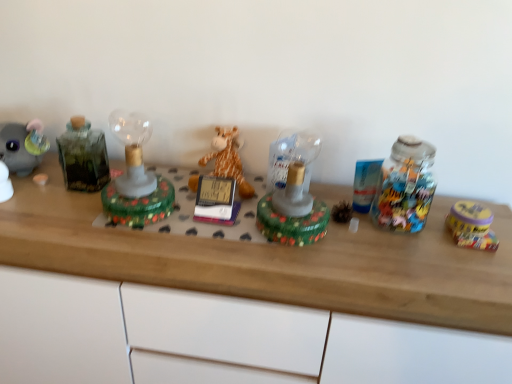
What do you see at coordinates (228, 159) in the screenshot? This screenshot has width=512, height=384. I see `soft plush giraffe at center, arranged as the third toy when viewed from the right` at bounding box center [228, 159].

What do you see at coordinates (272, 261) in the screenshot?
I see `wooden desk at center` at bounding box center [272, 261].

What do you see at coordinates (472, 226) in the screenshot? This screenshot has height=384, width=512. I see `yellow matte tin at right, acting as the 4th toy starting from the left` at bounding box center [472, 226].

What are the coordinates of `translucent glass lamp at center, the 2th toy positioned from the right` in the screenshot? It's located at (293, 195).

Is green glass bottle at left located within green glass lamp at center, the 1th toy in the left-to-right sequence?

No, green glass lamp at center, the 1th toy in the left-to-right sequence, does not contain green glass bottle at left.

From the picture: Is green glass lamp at center, which appears as the fourth toy when viewed from the right, bigger or smaller than green glass bottle at left?

green glass lamp at center, which appears as the fourth toy when viewed from the right, is bigger than green glass bottle at left.

From a real-world perspective, relative to green glass bottle at left, is green glass lamp at center, the 1th toy in the left-to-right sequence, vertically above or below?

green glass lamp at center, the 1th toy in the left-to-right sequence, is situated lower than green glass bottle at left in the real world.

Which of these two, yellow matte tin at right, the first toy when ordered from right to left, or green glass bottle at left, stands shorter?

yellow matte tin at right, the first toy when ordered from right to left.

Which of these two, yellow matte tin at right, acting as the 4th toy starting from the left, or green glass bottle at left, is bigger?

With larger size is green glass bottle at left.

Is yellow matte tin at right, acting as the 4th toy starting from the left, touching green glass bottle at left?

No, yellow matte tin at right, acting as the 4th toy starting from the left, is not making contact with green glass bottle at left.

Starting from the green glass bottle at left, which toy is the 4th one to the right? Please provide its 2D coordinates.

[(472, 226)]

Which is closer, (x=75, y=126) or (x=37, y=224)?

The point (x=37, y=224) is closer to the camera.

Is the depth of green glass bottle at left less than that of wooden desk at center?

No, green glass bottle at left is further to the viewer.

Is there a large distance between green glass bottle at left and wooden desk at center?

green glass bottle at left is actually quite close to wooden desk at center.

Which is correct: green glass bottle at left is inside wooden desk at center, or outside of it?

green glass bottle at left is spatially situated outside wooden desk at center.

Considering the relative sizes of wooden desk at center and yellow matte tin at right, the first toy when ordered from right to left, in the image provided, is wooden desk at center taller than yellow matte tin at right, the first toy when ordered from right to left,?

Indeed, wooden desk at center has a greater height compared to yellow matte tin at right, the first toy when ordered from right to left.

Considering the sizes of objects wooden desk at center and yellow matte tin at right, acting as the 4th toy starting from the left, in the image provided, who is wider, wooden desk at center or yellow matte tin at right, acting as the 4th toy starting from the left,?

With larger width is wooden desk at center.

In the scene shown: Are wooden desk at center and yellow matte tin at right, the first toy when ordered from right to left, far apart?

wooden desk at center is actually quite close to yellow matte tin at right, the first toy when ordered from right to left.

From a real-world perspective, is wooden desk at center beneath yellow matte tin at right, acting as the 4th toy starting from the left?

Yes.

Do you think translucent glass lamp at center, the third toy when ordered from left to right, is within green glass lamp at center, the 1th toy in the left-to-right sequence, or outside of it?

translucent glass lamp at center, the third toy when ordered from left to right, is located beyond the bounds of green glass lamp at center, the 1th toy in the left-to-right sequence.

Considering the positions of objects translucent glass lamp at center, the third toy when ordered from left to right, and green glass lamp at center, which appears as the fourth toy when viewed from the right, in the image provided, who is more to the left, translucent glass lamp at center, the third toy when ordered from left to right, or green glass lamp at center, which appears as the fourth toy when viewed from the right,?

green glass lamp at center, which appears as the fourth toy when viewed from the right, is more to the left.

Is translucent glass lamp at center, the 2th toy positioned from the right, aimed at green glass lamp at center, the 1th toy in the left-to-right sequence?

No, translucent glass lamp at center, the 2th toy positioned from the right, is not turned towards green glass lamp at center, the 1th toy in the left-to-right sequence.

Considering the sizes of objects green glass lamp at center, the 1th toy in the left-to-right sequence, and wooden desk at center in the image provided, who is thinner, green glass lamp at center, the 1th toy in the left-to-right sequence, or wooden desk at center?

green glass lamp at center, the 1th toy in the left-to-right sequence, is thinner.

Considering the positions of objects green glass lamp at center, which appears as the fourth toy when viewed from the right, and wooden desk at center in the image provided, who is more to the left, green glass lamp at center, which appears as the fourth toy when viewed from the right, or wooden desk at center?

From the viewer's perspective, green glass lamp at center, which appears as the fourth toy when viewed from the right, appears more on the left side.

In terms of size, does green glass lamp at center, which appears as the fourth toy when viewed from the right, appear bigger or smaller than wooden desk at center?

In the image, green glass lamp at center, which appears as the fourth toy when viewed from the right, appears to be smaller than wooden desk at center.

Find the location of a particular element. The image size is (512, 384). toy on the left of wooden desk at center is located at coordinates (135, 177).

Considering the sizes of objects green glass bottle at left and green glass lamp at center, the 1th toy in the left-to-right sequence, in the image provided, who is bigger, green glass bottle at left or green glass lamp at center, the 1th toy in the left-to-right sequence,?

green glass lamp at center, the 1th toy in the left-to-right sequence, is bigger.

From the image's perspective, is green glass bottle at left above or below green glass lamp at center, the 1th toy in the left-to-right sequence?

Clearly, from the image's perspective, green glass bottle at left is above green glass lamp at center, the 1th toy in the left-to-right sequence.

How different are the orientations of green glass bottle at left and green glass lamp at center, the 1th toy in the left-to-right sequence, in degrees?

The facing directions of green glass bottle at left and green glass lamp at center, the 1th toy in the left-to-right sequence, are 6.76e-05 degrees apart.

Where is `the 2nd toy below the green glass bottle at left (from the image's perspective)`? The image size is (512, 384). the 2nd toy below the green glass bottle at left (from the image's perspective) is located at coordinates (135, 177).

The height and width of the screenshot is (384, 512). In order to click on toy that is the 4th object directly below the green glass bottle at left (from a real-world perspective) in this screenshot , I will do `click(472, 226)`.

Estimate the real-world distances between objects in this image. Which object is further from green glass lamp at center, which appears as the fourth toy when viewed from the right, wooden desk at center or yellow matte tin at right, the first toy when ordered from right to left?

Among the two, yellow matte tin at right, the first toy when ordered from right to left, is located further to green glass lamp at center, which appears as the fourth toy when viewed from the right.

From the image, which object appears to be nearer to green glass lamp at center, which appears as the fourth toy when viewed from the right, green glass bottle at left or translucent glass lamp at center, the third toy when ordered from left to right?

The object closer to green glass lamp at center, which appears as the fourth toy when viewed from the right, is green glass bottle at left.

Consider the image. Which object lies further to the anchor point green glass bottle at left, translucent glass lamp at center, the 2th toy positioned from the right, or yellow matte tin at right, the first toy when ordered from right to left?

The object further to green glass bottle at left is yellow matte tin at right, the first toy when ordered from right to left.

Estimate the real-world distances between objects in this image. Which object is closer to soft plush giraffe at center, arranged as the third toy when viewed from the right, green glass bottle at left or yellow matte tin at right, the first toy when ordered from right to left?

green glass bottle at left.

From the image, which object appears to be nearer to yellow matte tin at right, acting as the 4th toy starting from the left, translucent glass lamp at center, the third toy when ordered from left to right, or soft plush giraffe at center, the 2th toy viewed from the left?

translucent glass lamp at center, the third toy when ordered from left to right.

From the image, which object appears to be nearer to yellow matte tin at right, acting as the 4th toy starting from the left, green glass bottle at left or wooden desk at center?

wooden desk at center lies closer to yellow matte tin at right, acting as the 4th toy starting from the left, than the other object.

Looking at the image, which one is located closer to yellow matte tin at right, the first toy when ordered from right to left, soft plush giraffe at center, the 2th toy viewed from the left, or translucent glass lamp at center, the third toy when ordered from left to right?

translucent glass lamp at center, the third toy when ordered from left to right, is positioned closer to the anchor yellow matte tin at right, the first toy when ordered from right to left.

Looking at the image, which one is located further to translucent glass lamp at center, the third toy when ordered from left to right, wooden desk at center or soft plush giraffe at center, the 2th toy viewed from the left?

wooden desk at center.

The image size is (512, 384). I want to click on desk between green glass lamp at center, the 1th toy in the left-to-right sequence, and yellow matte tin at right, acting as the 4th toy starting from the left, from left to right, so click(x=272, y=261).

The height and width of the screenshot is (384, 512). In order to click on toy between green glass bottle at left and soft plush giraffe at center, the 2th toy viewed from the left, in the horizontal direction in this screenshot , I will do `click(135, 177)`.

You are a GUI agent. You are given a task and a screenshot of the screen. Output one action in this format:
    pyautogui.click(x=<x>, y=<y>)
    Task: Click on the toy situated between soft plush giraffe at center, the 2th toy viewed from the left, and yellow matte tin at right, the first toy when ordered from right to left, from left to right
    
    Given the screenshot: What is the action you would take?
    pyautogui.click(x=293, y=195)

Locate an element on the screen. This screenshot has height=384, width=512. toy located between green glass lamp at center, which appears as the fourth toy when viewed from the right, and translucent glass lamp at center, the 2th toy positioned from the right, in the left-right direction is located at coordinates (228, 159).